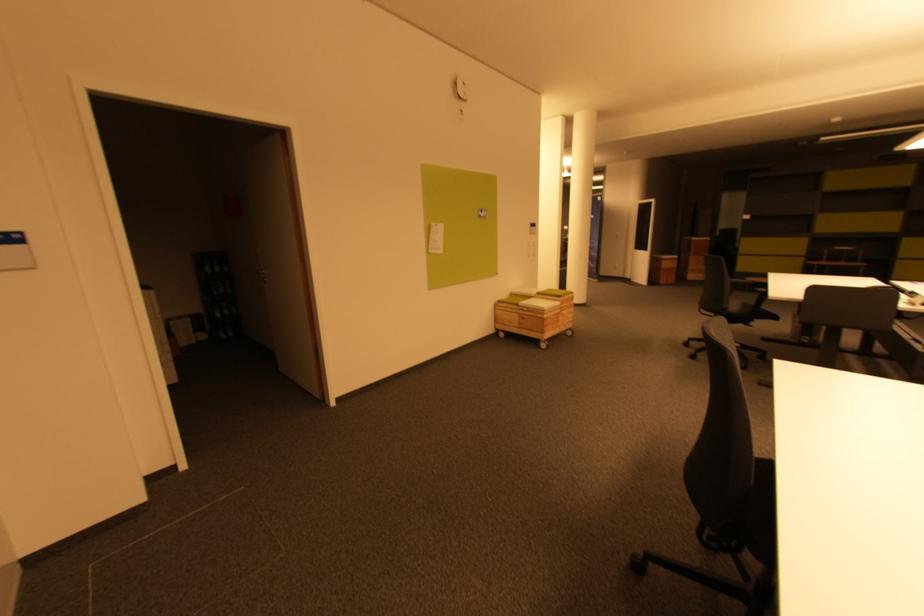
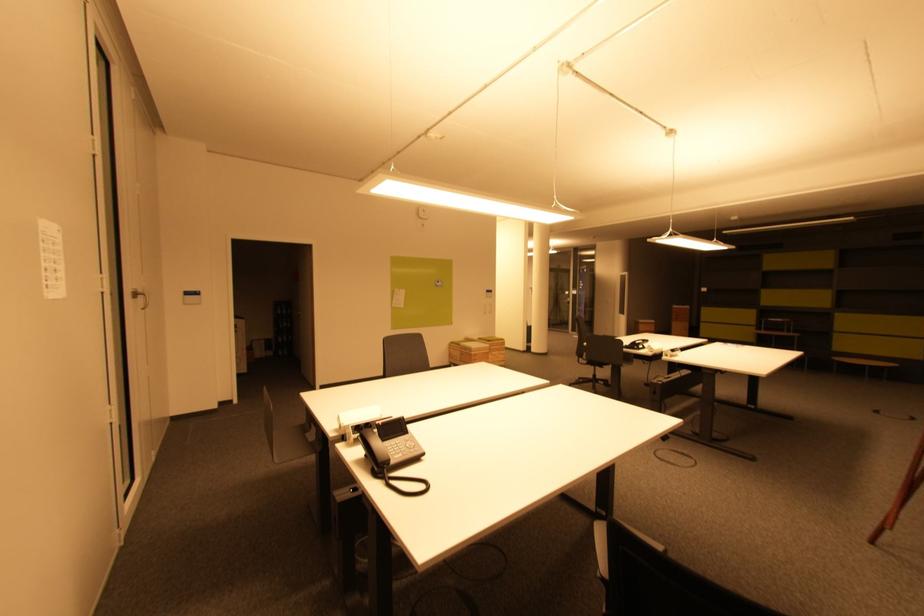
In a continuous first-person perspective shot, in which direction is the camera moving?

The cameraman moved toward right, backward.